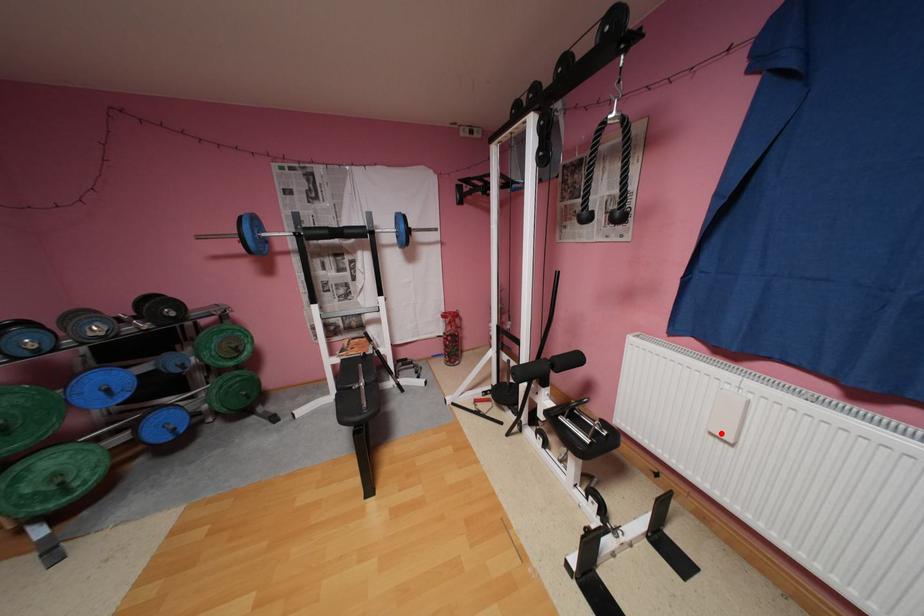
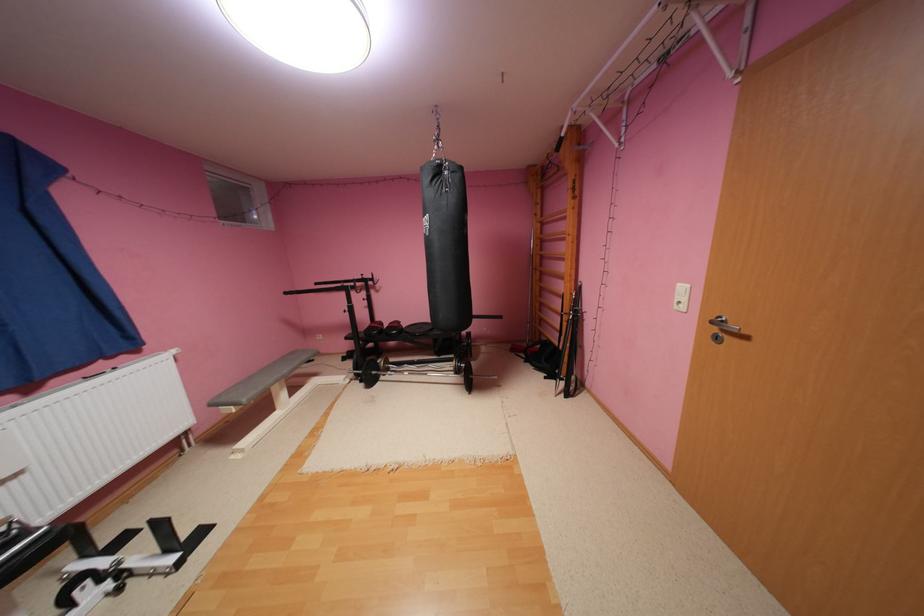
In the second image, find the point that corresponds to the highlighted location in the first image.

(11, 483)